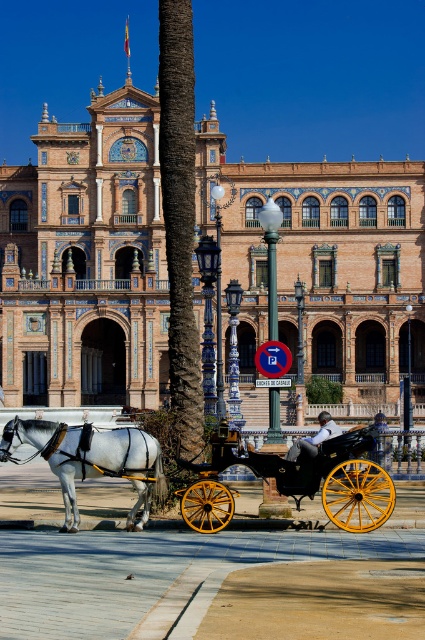
Does golden ornate building at center appear under wooden polished coach at center?

Incorrect, golden ornate building at center is not positioned below wooden polished coach at center.

Who is positioned more to the left, golden ornate building at center or wooden polished coach at center?

golden ornate building at center is more to the left.

Is point (314, 316) less distant than point (312, 444)?

No.

At what (x,y) coordinates should I click in order to perform the action: click on golden ornate building at center. Please return your answer as a coordinate pair (x, y). Looking at the image, I should click on (87, 260).

Does point (125, 115) come behind point (112, 474)?

Yes, it is.

Where is `golden ornate building at center`? This screenshot has height=640, width=425. golden ornate building at center is located at coordinates (87, 260).

Does shiny gold wheels at center have a lesser width compared to white glossy horse at left?

No.

Who is more forward, (206, 477) or (70, 486)?

Point (206, 477)

Image resolution: width=425 pixels, height=640 pixels. I want to click on shiny gold wheels at center, so click(294, 481).